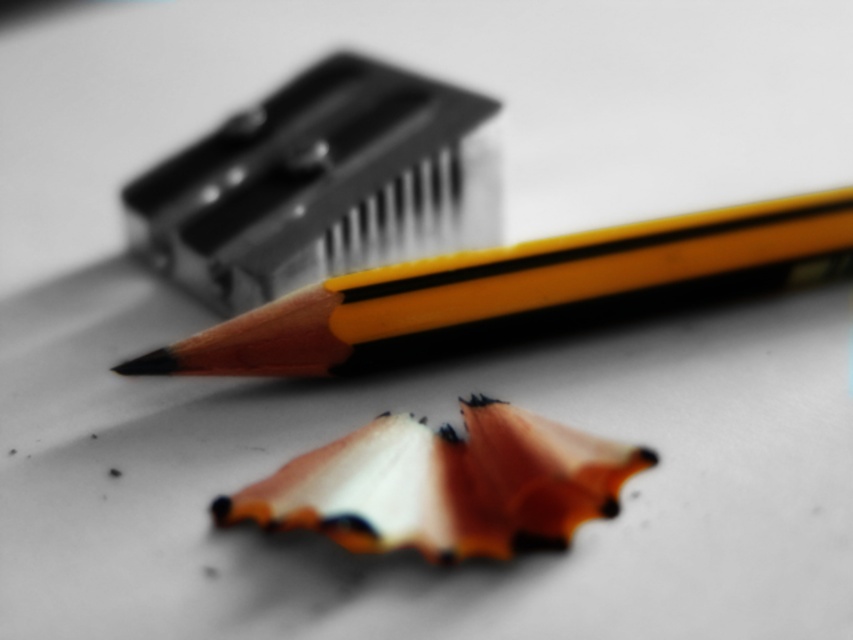
Question: Which of these objects is positioned closest to the orange wood pencil at center?

Choices:
 (A) matte yellow pencil at upper center
 (B) wooden pencil at center

Answer: (B)

Question: Which point is farther to the camera?

Choices:
 (A) orange wood pencil at center
 (B) wooden pencil at center
 (C) matte yellow pencil at upper center

Answer: (C)

Question: Which point is closer to the camera?

Choices:
 (A) (196, 262)
 (B) (202, 362)
 (C) (508, 490)

Answer: (C)

Question: Can you confirm if matte yellow pencil at upper center is bigger than orange wood pencil at center?

Choices:
 (A) no
 (B) yes

Answer: (B)

Question: Can you confirm if matte yellow pencil at upper center is positioned to the left of wooden pencil at center?

Choices:
 (A) no
 (B) yes

Answer: (B)

Question: Can you confirm if wooden pencil at center is smaller than orange wood pencil at center?

Choices:
 (A) no
 (B) yes

Answer: (A)